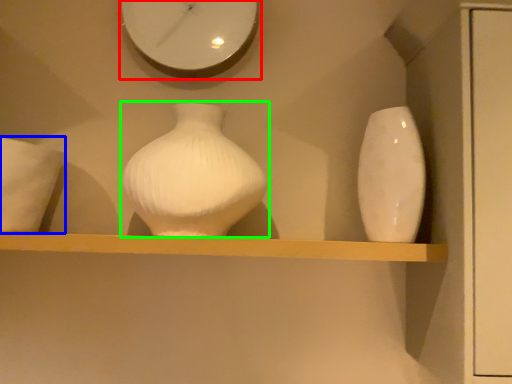
Question: Estimate the real-world distances between objects in this image. Which object is closer to clock (highlighted by a red box), pillow (highlighted by a blue box) or vase (highlighted by a green box)?

Choices:
 (A) pillow
 (B) vase

Answer: (B)